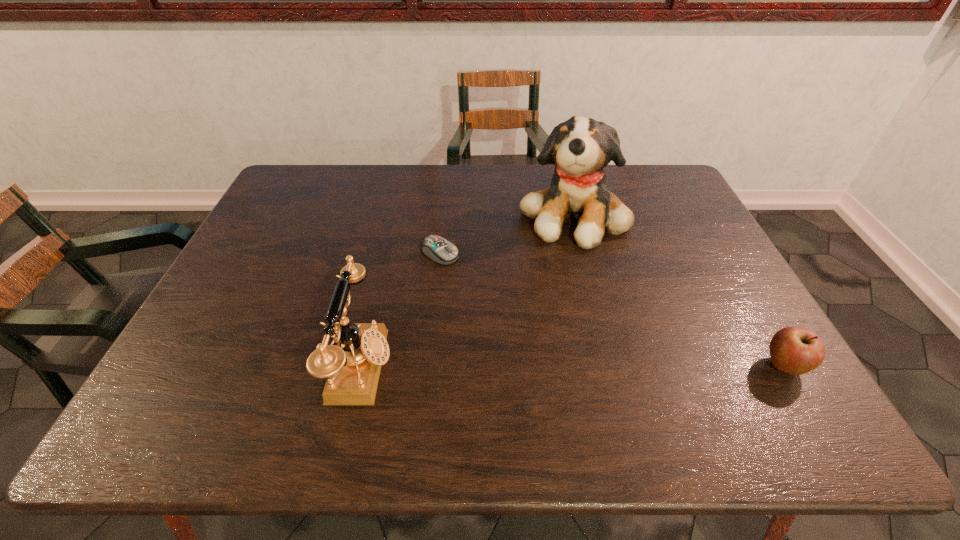
Locate an element on the screen. object that is at the near right corner is located at coordinates (793, 350).

This screenshot has width=960, height=540. I want to click on vacant area at the far edge of the desktop, so click(345, 189).

Where is `vacant space at the left edge`? This screenshot has height=540, width=960. vacant space at the left edge is located at coordinates (249, 279).

Locate an element on the screen. The image size is (960, 540). vacant space at the right edge of the desktop is located at coordinates (697, 310).

Find the location of a particular element. The height and width of the screenshot is (540, 960). unoccupied area between the tallest object and the third tallest object is located at coordinates (679, 291).

I want to click on free space that is in between the second shortest object and the shortest object, so click(x=612, y=310).

Image resolution: width=960 pixels, height=540 pixels. Identify the location of vacant area that lies between the leftmost object and the tallest object. point(468,291).

Locate an element on the screen. The image size is (960, 540). free space between the tallest object and the rightmost object is located at coordinates (679, 291).

At what (x,y) coordinates should I click in order to perform the action: click on unoccupied area between the second tallest object and the tallest object. Please return your answer as a coordinate pair (x, y). The height and width of the screenshot is (540, 960). Looking at the image, I should click on (468, 291).

The width and height of the screenshot is (960, 540). In order to click on free space between the third tallest object and the second object from right to left in this screenshot , I will do `click(679, 291)`.